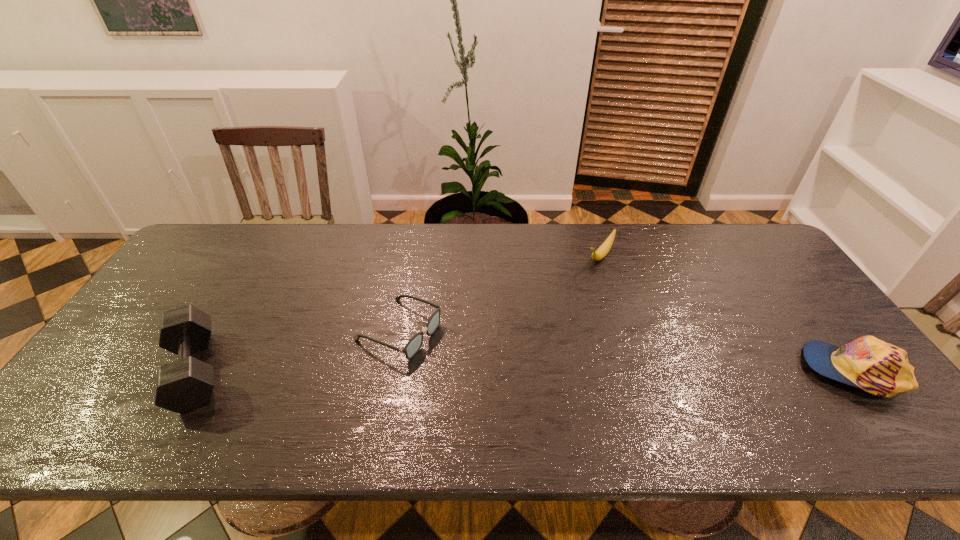
Locate an element on the screen. Image resolution: width=960 pixels, height=540 pixels. blank region between the banana and the rightmost object is located at coordinates (727, 313).

In order to click on free point between the cap and the third object from right to left in this screenshot , I will do `click(627, 350)`.

What are the coordinates of `empty location between the dumbbell and the second shortest object` in the screenshot? It's located at (397, 313).

The height and width of the screenshot is (540, 960). I want to click on free space that is in between the second object from right to left and the cap, so click(x=727, y=313).

In order to click on empty location between the dumbbell and the cap in this screenshot , I will do `click(524, 370)`.

The height and width of the screenshot is (540, 960). I want to click on free spot between the rightmost object and the third tallest object, so click(x=727, y=313).

Where is `object that is the closest to the third object from right to left`? The image size is (960, 540). object that is the closest to the third object from right to left is located at coordinates (185, 384).

Locate which object is the second closest to the cap. Please provide its 2D coordinates. Your answer should be formatted as a tuple, i.e. [(x, y)], where the tuple contains the x and y coordinates of a point satisfying the conditions above.

[(414, 344)]

This screenshot has width=960, height=540. Identify the location of free space in the image that satisfies the following two spatial constraints: 1. on the front side of the spectacles; 2. on the bill of the rightmost object. (393, 370).